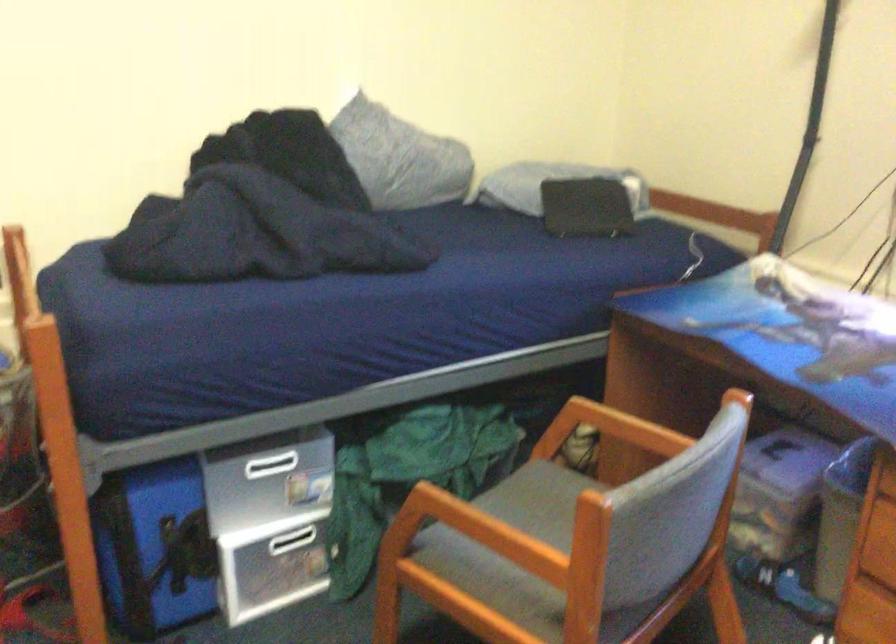
In order to click on wooden chair armrest in this screenshot , I will do `click(519, 518)`.